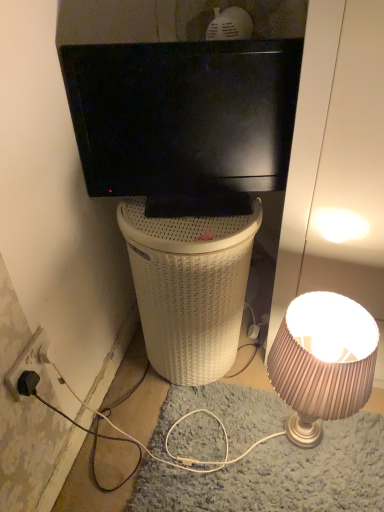
Question: Can you confirm if black glossy television at upper center is bigger than black plastic power outlet at lower left?

Choices:
 (A) no
 (B) yes

Answer: (B)

Question: Is black glossy television at upper center turned away from black plastic power outlet at lower left?

Choices:
 (A) no
 (B) yes

Answer: (A)

Question: Is black glossy television at upper center closer to camera compared to black plastic power outlet at lower left?

Choices:
 (A) yes
 (B) no

Answer: (B)

Question: Is black glossy television at upper center next to black plastic power outlet at lower left and touching it?

Choices:
 (A) yes
 (B) no

Answer: (B)

Question: Could you tell me if black glossy television at upper center is facing black plastic power outlet at lower left?

Choices:
 (A) no
 (B) yes

Answer: (A)

Question: Considering the positions of shiny beige lampshade at right and black plastic power outlet at lower left in the image, is shiny beige lampshade at right wider or thinner than black plastic power outlet at lower left?

Choices:
 (A) wide
 (B) thin

Answer: (A)

Question: In terms of size, does shiny beige lampshade at right appear bigger or smaller than black plastic power outlet at lower left?

Choices:
 (A) big
 (B) small

Answer: (A)

Question: From the image's perspective, is shiny beige lampshade at right above or below black plastic power outlet at lower left?

Choices:
 (A) below
 (B) above

Answer: (A)

Question: Which is correct: shiny beige lampshade at right is inside black plastic power outlet at lower left, or outside of it?

Choices:
 (A) outside
 (B) inside

Answer: (A)

Question: Would you say white wicker trash bin/can at center is inside or outside black glossy television at upper center?

Choices:
 (A) inside
 (B) outside

Answer: (B)

Question: From a real-world perspective, is white wicker trash bin/can at center physically located above or below black glossy television at upper center?

Choices:
 (A) below
 (B) above

Answer: (A)

Question: Is white wicker trash bin/can at center in front of or behind black glossy television at upper center in the image?

Choices:
 (A) behind
 (B) front

Answer: (A)

Question: Is white wicker trash bin/can at center taller or shorter than black glossy television at upper center?

Choices:
 (A) tall
 (B) short

Answer: (A)

Question: Considering their positions, is shiny beige lampshade at right located in front of or behind white wicker trash bin/can at center?

Choices:
 (A) front
 (B) behind

Answer: (A)

Question: In terms of height, does shiny beige lampshade at right look taller or shorter compared to white wicker trash bin/can at center?

Choices:
 (A) short
 (B) tall

Answer: (A)